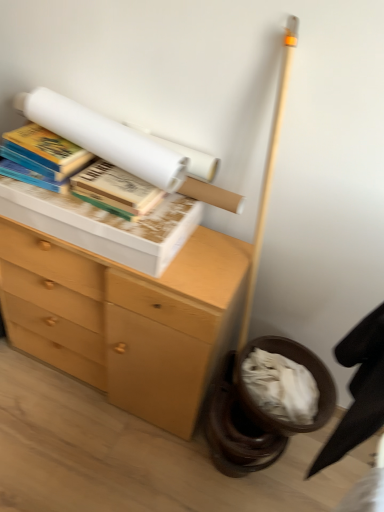
Describe the element at coordinates (105, 138) in the screenshot. I see `white paper at upper center, arranged as the second book when viewed from the right` at that location.

What do you see at coordinates (115, 190) in the screenshot? This screenshot has height=512, width=384. I see `hardcover book at upper left, the 1th book from the right` at bounding box center [115, 190].

Describe the element at coordinates (124, 318) in the screenshot. This screenshot has width=384, height=512. I see `wooden chest of drawers at left` at that location.

Locate an element on the screen. This screenshot has width=384, height=512. white paper at upper center, arranged as the 2th book when viewed from the left is located at coordinates (105, 138).

Locate an element on the screen. The height and width of the screenshot is (512, 384). book on the left of wooden chest of drawers at left is located at coordinates (44, 152).

Which is closer to the camera, (57, 331) or (32, 137)?

Point (57, 331) is positioned farther from the camera compared to point (32, 137).

Is wooden chest of drawers at left facing towards hardcover book at upper left, which ranks as the 1th book in left-to-right order?

No, wooden chest of drawers at left is not aimed at hardcover book at upper left, which ranks as the 1th book in left-to-right order.

From a real-world perspective, who is located lower, black fabric swivel chair at lower right or white paper at upper center, arranged as the second book when viewed from the right?

black fabric swivel chair at lower right is physically lower.

Is black fabric swivel chair at lower right placed right next to white paper at upper center, arranged as the second book when viewed from the right?

black fabric swivel chair at lower right and white paper at upper center, arranged as the second book when viewed from the right, are not in contact.

Is black fabric swivel chair at lower right surrounding white paper at upper center, arranged as the second book when viewed from the right?

Actually, white paper at upper center, arranged as the second book when viewed from the right, is outside black fabric swivel chair at lower right.

Measure the distance from black fabric swivel chair at lower right to white paper at upper center, arranged as the second book when viewed from the right.

black fabric swivel chair at lower right and white paper at upper center, arranged as the second book when viewed from the right, are 30.14 inches apart from each other.

Which of these two, black fabric swivel chair at lower right or wooden chest of drawers at left, is thinner?

black fabric swivel chair at lower right.

From a real-world perspective, who is located lower, black fabric swivel chair at lower right or wooden chest of drawers at left?

wooden chest of drawers at left, from a real-world perspective.

Is black fabric swivel chair at lower right oriented away from wooden chest of drawers at left?

No, black fabric swivel chair at lower right is not facing the opposite direction of wooden chest of drawers at left.

Is black fabric swivel chair at lower right positioned far away from wooden chest of drawers at left?

Actually, black fabric swivel chair at lower right and wooden chest of drawers at left are a little close together.

Is white paper at upper center, arranged as the 2th book when viewed from the left, taller or shorter than hardcover book at upper left, which ranks as the 3th book in left-to-right order?

Clearly, white paper at upper center, arranged as the 2th book when viewed from the left, is taller compared to hardcover book at upper left, which ranks as the 3th book in left-to-right order.

Does white paper at upper center, arranged as the second book when viewed from the right, have a larger size compared to hardcover book at upper left, which ranks as the 3th book in left-to-right order?

Correct, white paper at upper center, arranged as the second book when viewed from the right, is larger in size than hardcover book at upper left, which ranks as the 3th book in left-to-right order.

Does white paper at upper center, arranged as the second book when viewed from the right, lie behind hardcover book at upper left, the 1th book from the right?

No, it is not.

Does wooden chest of drawers at left appear on the right side of hardcover book at upper left, which ranks as the 3th book in left-to-right order?

In fact, wooden chest of drawers at left is to the left of hardcover book at upper left, which ranks as the 3th book in left-to-right order.

Can you tell me how much wooden chest of drawers at left and hardcover book at upper left, which ranks as the 3th book in left-to-right order, differ in facing direction?

There is a 0.304-degree angle between the facing directions of wooden chest of drawers at left and hardcover book at upper left, which ranks as the 3th book in left-to-right order.

From a real-world perspective, is wooden chest of drawers at left physically above hardcover book at upper left, which ranks as the 3th book in left-to-right order?

Incorrect, from a real-world perspective, wooden chest of drawers at left is lower than hardcover book at upper left, which ranks as the 3th book in left-to-right order.

Which is less distant, (215, 236) or (112, 174)?

Point (215, 236) is positioned farther from the camera compared to point (112, 174).

Is hardcover book at upper left, which ranks as the 1th book in left-to-right order, in front of or behind wooden chest of drawers at left in the image?

In the image, hardcover book at upper left, which ranks as the 1th book in left-to-right order, appears behind wooden chest of drawers at left.

Is hardcover book at upper left, which is counted as the third book, starting from the right, inside the boundaries of wooden chest of drawers at left, or outside?

hardcover book at upper left, which is counted as the third book, starting from the right, is not enclosed by wooden chest of drawers at left.

Between point (43, 173) and point (46, 264), which one is positioned behind?

The point (46, 264) is behind.

Considering the positions of objects black fabric swivel chair at lower right and hardcover book at upper left, the 1th book from the right, in the image provided, who is behind, black fabric swivel chair at lower right or hardcover book at upper left, the 1th book from the right,?

hardcover book at upper left, the 1th book from the right, is further away from the camera.

From the image's perspective, is black fabric swivel chair at lower right above hardcover book at upper left, the 1th book from the right?

No, from the image's perspective, black fabric swivel chair at lower right is not over hardcover book at upper left, the 1th book from the right.

Considering the sizes of objects black fabric swivel chair at lower right and hardcover book at upper left, which ranks as the 3th book in left-to-right order, in the image provided, who is thinner, black fabric swivel chair at lower right or hardcover book at upper left, which ranks as the 3th book in left-to-right order,?

hardcover book at upper left, which ranks as the 3th book in left-to-right order, is thinner.

Considering the positions of objects black fabric swivel chair at lower right and hardcover book at upper left, the 1th book from the right, in the image provided, who is more to the right, black fabric swivel chair at lower right or hardcover book at upper left, the 1th book from the right,?

From the viewer's perspective, black fabric swivel chair at lower right appears more on the right side.

Find the location of `chest of drawers below the hardcover book at upper left, which ranks as the 1th book in left-to-right order (from a real-world perspective)`. chest of drawers below the hardcover book at upper left, which ranks as the 1th book in left-to-right order (from a real-world perspective) is located at coordinates (124, 318).

Where is `the 3rd book located above the black fabric swivel chair at lower right (from a real-world perspective)`? the 3rd book located above the black fabric swivel chair at lower right (from a real-world perspective) is located at coordinates (105, 138).

Which object lies further to the anchor point hardcover book at upper left, which ranks as the 3th book in left-to-right order, black fabric swivel chair at lower right or white paper at upper center, arranged as the 2th book when viewed from the left?

black fabric swivel chair at lower right is further to hardcover book at upper left, which ranks as the 3th book in left-to-right order.

Looking at the image, which one is located closer to white paper at upper center, arranged as the 2th book when viewed from the left, hardcover book at upper left, the 1th book from the right, or wooden chest of drawers at left?

hardcover book at upper left, the 1th book from the right, lies closer to white paper at upper center, arranged as the 2th book when viewed from the left, than the other object.

Looking at the image, which one is located further to hardcover book at upper left, which is counted as the third book, starting from the right, black fabric swivel chair at lower right or hardcover book at upper left, which ranks as the 3th book in left-to-right order?

The object further to hardcover book at upper left, which is counted as the third book, starting from the right, is black fabric swivel chair at lower right.

From the picture: Which object lies nearer to the anchor point white paper at upper center, arranged as the 2th book when viewed from the left, wooden chest of drawers at left or hardcover book at upper left, which ranks as the 3th book in left-to-right order?

Based on the image, hardcover book at upper left, which ranks as the 3th book in left-to-right order, appears to be nearer to white paper at upper center, arranged as the 2th book when viewed from the left.

When comparing their distances from black fabric swivel chair at lower right, does wooden chest of drawers at left or white paper at upper center, arranged as the 2th book when viewed from the left, seem closer?

wooden chest of drawers at left is positioned closer to the anchor black fabric swivel chair at lower right.

Looking at the image, which one is located closer to hardcover book at upper left, the 1th book from the right, white paper at upper center, arranged as the 2th book when viewed from the left, or hardcover book at upper left, which ranks as the 1th book in left-to-right order?

white paper at upper center, arranged as the 2th book when viewed from the left, lies closer to hardcover book at upper left, the 1th book from the right, than the other object.

Looking at the image, which one is located further to black fabric swivel chair at lower right, wooden chest of drawers at left or hardcover book at upper left, which is counted as the third book, starting from the right?

hardcover book at upper left, which is counted as the third book, starting from the right, lies further to black fabric swivel chair at lower right than the other object.

Estimate the real-world distances between objects in this image. Which object is further from wooden chest of drawers at left, hardcover book at upper left, which ranks as the 3th book in left-to-right order, or black fabric swivel chair at lower right?

Based on the image, black fabric swivel chair at lower right appears to be further to wooden chest of drawers at left.

Where is `book between hardcover book at upper left, which ranks as the 1th book in left-to-right order, and hardcover book at upper left, which ranks as the 3th book in left-to-right order, from left to right`? This screenshot has width=384, height=512. book between hardcover book at upper left, which ranks as the 1th book in left-to-right order, and hardcover book at upper left, which ranks as the 3th book in left-to-right order, from left to right is located at coordinates (105, 138).

At what (x,y) coordinates should I click in order to perform the action: click on book situated between white paper at upper center, arranged as the second book when viewed from the right, and black fabric swivel chair at lower right from left to right. Please return your answer as a coordinate pair (x, y). Image resolution: width=384 pixels, height=512 pixels. Looking at the image, I should click on (115, 190).

The height and width of the screenshot is (512, 384). In order to click on book between hardcover book at upper left, which is counted as the third book, starting from the right, and wooden chest of drawers at left, in the vertical direction in this screenshot , I will do [115, 190].

Image resolution: width=384 pixels, height=512 pixels. I want to click on the chest of drawers located between hardcover book at upper left, which ranks as the 1th book in left-to-right order, and black fabric swivel chair at lower right in the left-right direction, so click(x=124, y=318).